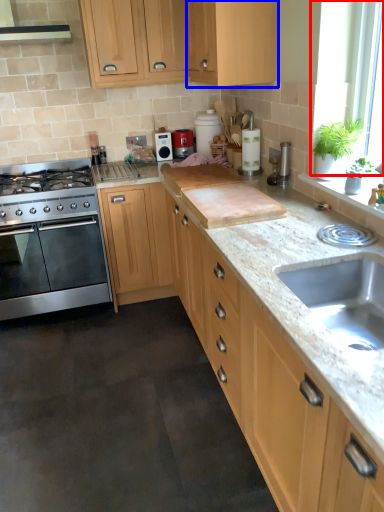
Question: Which object is closer to the camera taking this photo, window screen (highlighted by a red box) or cabinetry (highlighted by a blue box)?

Choices:
 (A) window screen
 (B) cabinetry

Answer: (A)